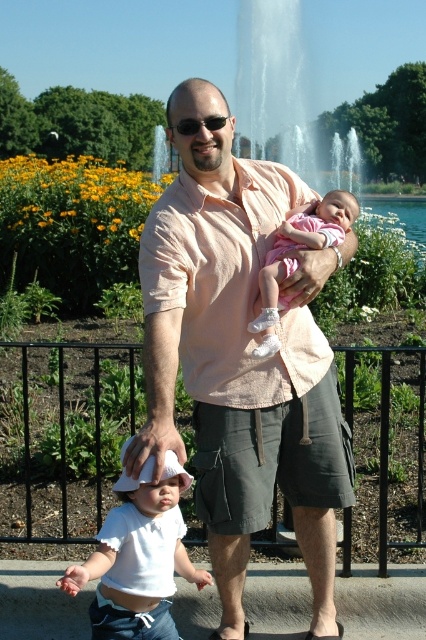
You are a photographer taking a picture of the man and the toddler. You notice the white cotton shirt at lower left and the sunglasses at center. Which object is closer to the bottom of the image?

The white cotton shirt at lower left is positioned under sunglasses at center, so it is closer to the bottom of the image.

You are a photographer taking a picture of the scene. You notice two points marked in the image. The first point is at coordinate point (348,248) and the second is at point (279,298). Which point is closer to your camera?

Point (348,248) is further to the camera than point (279,298), so the second point is closer to the camera.

You are a photographer setting up a wide shot of the scene. You need to ensure both the pink cotton shirt at center and the pink fabric baby at center are fully visible in the frame. Which object requires more horizontal space in the frame to accommodate its width?

The pink cotton shirt at center requires more horizontal space in the frame because its width surpasses that of the pink fabric baby at center.